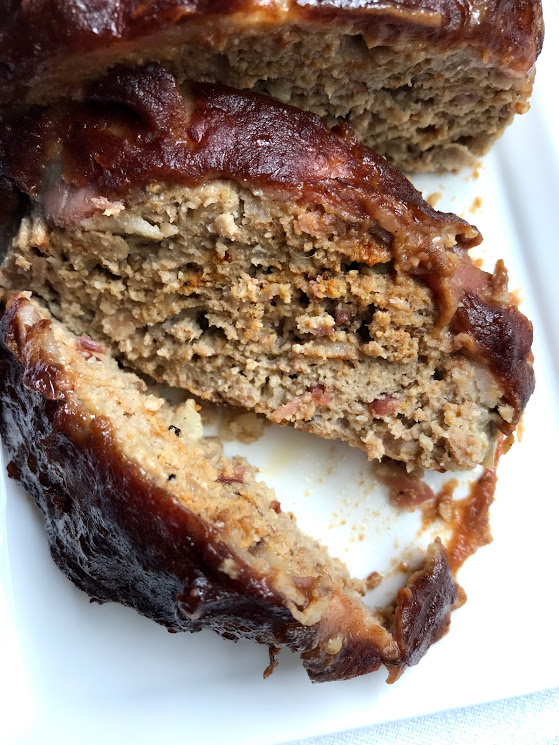
You are a GUI agent. You are given a task and a screenshot of the screen. Output one action in this format:
    pyautogui.click(x=<x>, y=<y>)
    Task: Click on the white plate
    
    Given the screenshot: What is the action you would take?
    pyautogui.click(x=536, y=234)